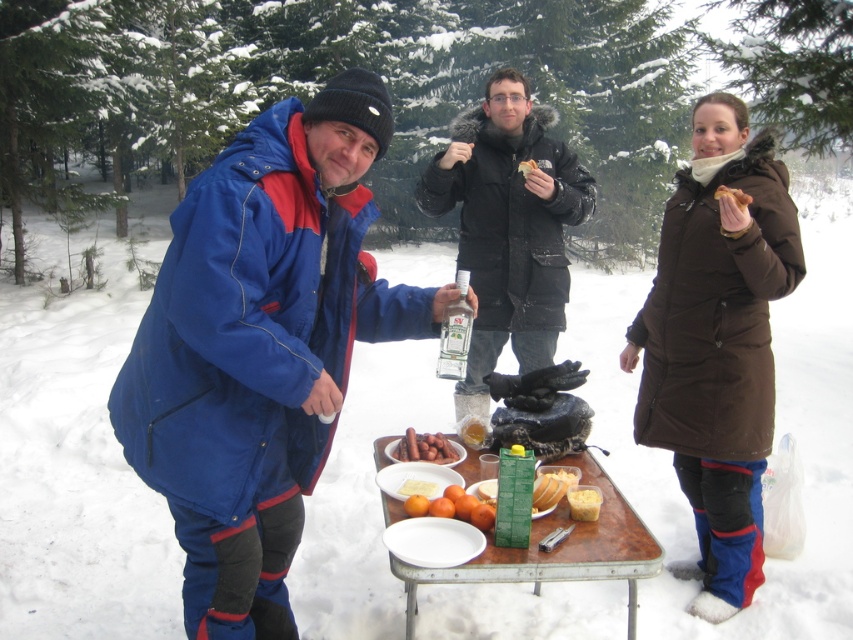
Question: Which object appears closest to the camera in this image?

Choices:
 (A) wooden table at center
 (B) brown crumbly bread at upper center
 (C) brown fuzzy coat at right

Answer: (A)

Question: Which of the following is the closest to the observer?

Choices:
 (A) brown crumbly bread at upper center
 (B) brown matte hot dogs at center

Answer: (B)

Question: Which of the following is the farthest from the observer?

Choices:
 (A) (534, 163)
 (B) (490, 170)
 (C) (556, 481)

Answer: (B)

Question: Can you confirm if black matte jacket at center is positioned above brown matte hot dogs at center?

Choices:
 (A) yes
 (B) no

Answer: (A)

Question: Does white matte plate at center appear over brown crumbly bread at upper center?

Choices:
 (A) yes
 (B) no

Answer: (B)

Question: Does blue insulated jacket at left have a greater width compared to yellow sponge cake at center?

Choices:
 (A) no
 (B) yes

Answer: (B)